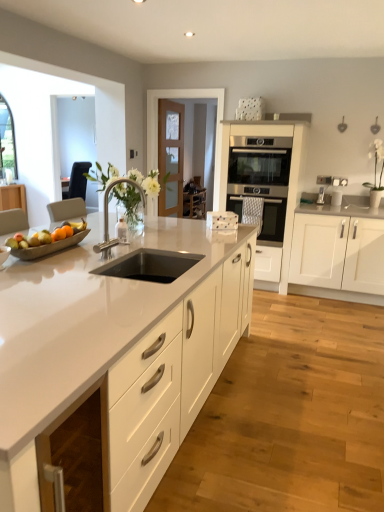
Question: From a real-world perspective, is white glossy vase at right physically above wooden chair at center?

Choices:
 (A) no
 (B) yes

Answer: (B)

Question: Is white glossy vase at right next to wooden chair at center?

Choices:
 (A) no
 (B) yes

Answer: (A)

Question: Does white glossy vase at right have a lesser width compared to wooden chair at center?

Choices:
 (A) yes
 (B) no

Answer: (A)

Question: Is wooden chair at center located within white glossy vase at right?

Choices:
 (A) no
 (B) yes

Answer: (A)

Question: Is white glossy vase at right looking in the opposite direction of wooden chair at center?

Choices:
 (A) yes
 (B) no

Answer: (B)

Question: Considering the relative sizes of white glossy vase at right and wooden chair at center in the image provided, is white glossy vase at right smaller than wooden chair at center?

Choices:
 (A) yes
 (B) no

Answer: (A)

Question: From a real-world perspective, is white matte cabinet at right, the 1th cabinetry viewed from the right, positioned under black stainless steel sink at center based on gravity?

Choices:
 (A) yes
 (B) no

Answer: (A)

Question: Can you confirm if white matte cabinet at right, the 1th cabinetry viewed from the right, is smaller than black stainless steel sink at center?

Choices:
 (A) yes
 (B) no

Answer: (B)

Question: From the image's perspective, is white matte cabinet at right, the 3th cabinetry viewed from the left, on top of black stainless steel sink at center?

Choices:
 (A) no
 (B) yes

Answer: (B)

Question: Considering the relative sizes of white matte cabinet at right, the 3th cabinetry viewed from the left, and black stainless steel sink at center in the image provided, is white matte cabinet at right, the 3th cabinetry viewed from the left, taller than black stainless steel sink at center?

Choices:
 (A) yes
 (B) no

Answer: (A)

Question: Is the position of white matte cabinet at right, the 1th cabinetry viewed from the right, less distant than that of black stainless steel sink at center?

Choices:
 (A) yes
 (B) no

Answer: (B)

Question: From the image's perspective, is white matte cabinet at right, the 1th cabinetry viewed from the right, located beneath black stainless steel sink at center?

Choices:
 (A) no
 (B) yes

Answer: (A)

Question: Does wooden chair at center have a smaller size compared to black stainless steel sink at center?

Choices:
 (A) yes
 (B) no

Answer: (B)